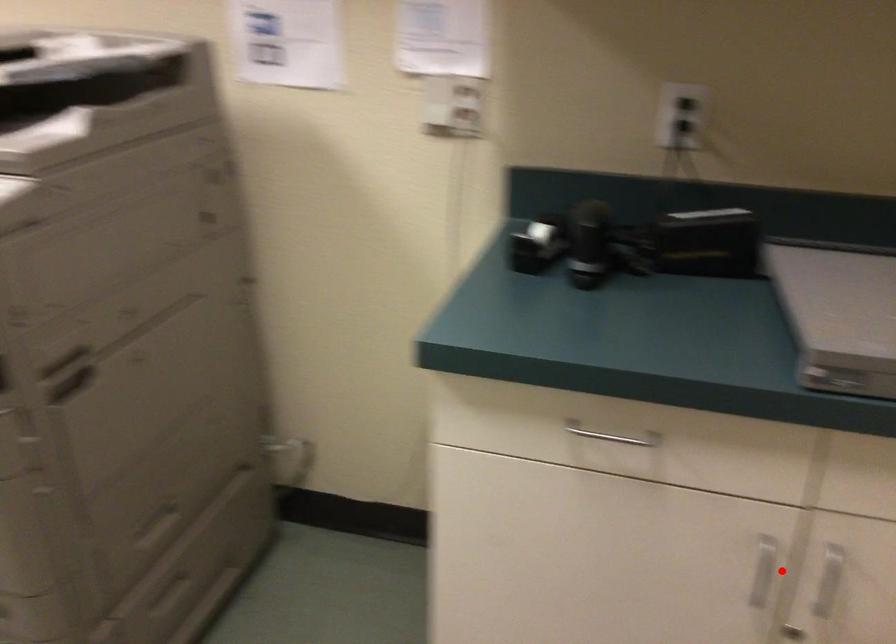
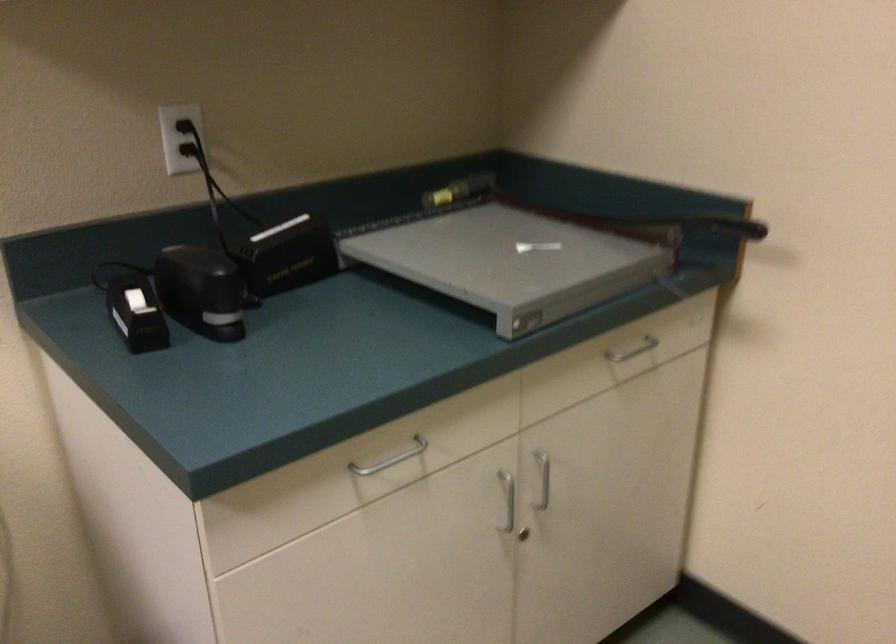
Question: I am providing you with two images of the same scene from different viewpoints. Image1 has a red point marked. In image2, the corresponding 3D location appears at what relative position? Reply with the corresponding letter.

Choices:
 (A) Closer
 (B) Farther

Answer: (B)